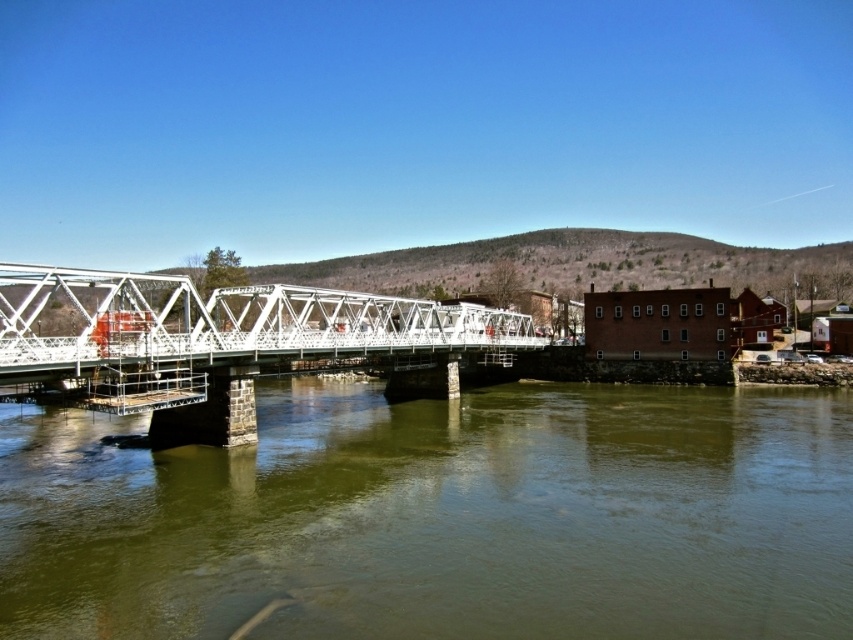
Who is taller, green murky water at center or white metallic bridge at center?

white metallic bridge at center

Consider the image. How far apart are green murky water at center and white metallic bridge at center?

green murky water at center is 21.02 meters from white metallic bridge at center.

Between point (82, 620) and point (113, 401), which one is positioned in front?

Positioned in front is point (82, 620).

Identify the location of green murky water at center. This screenshot has width=853, height=640. (439, 516).